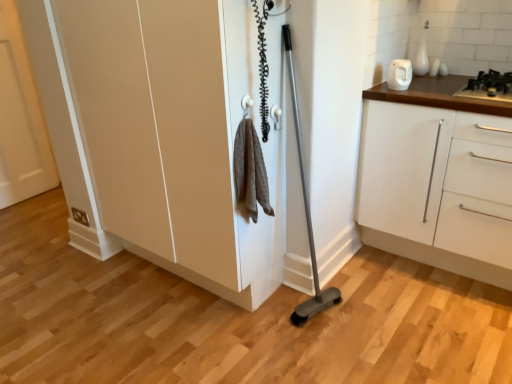
Question: From a real-world perspective, relative to matte white cupboard at center, is black metallic gas stove at upper right vertically above or below?

Choices:
 (A) below
 (B) above

Answer: (B)

Question: Is black metallic gas stove at upper right situated inside matte white cupboard at center or outside?

Choices:
 (A) outside
 (B) inside

Answer: (A)

Question: Which object is positioned farthest from the white matte cabinet at right?

Choices:
 (A) white matte door at left
 (B) white glossy kettle at upper right
 (C) matte white cupboard at center
 (D) black metallic gas stove at upper right

Answer: (A)

Question: Estimate the real-world distances between objects in this image. Which object is closer to the white glossy kettle at upper right?

Choices:
 (A) white matte door at left
 (B) matte white cupboard at center
 (C) white matte cabinet at right
 (D) black metallic gas stove at upper right

Answer: (D)